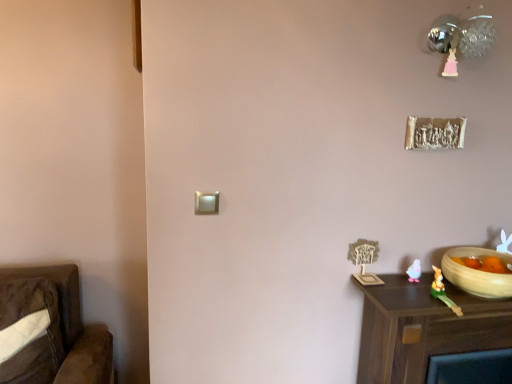
Question: Can you confirm if brown wood nightstand at lower right is positioned to the left of green rubber rabbit at lower right, arranged as the 1th toy when viewed from the front?

Choices:
 (A) yes
 (B) no

Answer: (B)

Question: Is there a large distance between brown wood nightstand at lower right and green rubber rabbit at lower right, which appears as the 2th toy when viewed from the back?

Choices:
 (A) yes
 (B) no

Answer: (B)

Question: From a real-world perspective, does brown wood nightstand at lower right sit lower than green rubber rabbit at lower right, which appears as the 2th toy when viewed from the back?

Choices:
 (A) yes
 (B) no

Answer: (A)

Question: Does brown wood nightstand at lower right come in front of green rubber rabbit at lower right, which appears as the 2th toy when viewed from the back?

Choices:
 (A) yes
 (B) no

Answer: (B)

Question: Is brown wood nightstand at lower right turned away from green rubber rabbit at lower right, arranged as the 1th toy when viewed from the front?

Choices:
 (A) no
 (B) yes

Answer: (A)

Question: Choose the correct answer: Is green rubber rabbit at lower right, arranged as the 1th toy when viewed from the front, inside metallic sphere at upper right or outside it?

Choices:
 (A) outside
 (B) inside

Answer: (A)

Question: Would you say green rubber rabbit at lower right, arranged as the 1th toy when viewed from the front, is to the left or to the right of metallic sphere at upper right in the picture?

Choices:
 (A) right
 (B) left

Answer: (B)

Question: Looking at their shapes, would you say green rubber rabbit at lower right, which appears as the 2th toy when viewed from the back, is wider or thinner than metallic sphere at upper right?

Choices:
 (A) wide
 (B) thin

Answer: (B)

Question: From their relative heights in the image, would you say green rubber rabbit at lower right, arranged as the 1th toy when viewed from the front, is taller or shorter than metallic sphere at upper right?

Choices:
 (A) short
 (B) tall

Answer: (A)

Question: From the image's perspective, is beige ceramic bowl at lower right above or below brown wood nightstand at lower right?

Choices:
 (A) below
 (B) above

Answer: (B)

Question: Would you say beige ceramic bowl at lower right is to the left or to the right of brown wood nightstand at lower right in the picture?

Choices:
 (A) left
 (B) right

Answer: (B)

Question: Looking at the image, does beige ceramic bowl at lower right seem bigger or smaller compared to brown wood nightstand at lower right?

Choices:
 (A) big
 (B) small

Answer: (B)

Question: Considering the positions of beige ceramic bowl at lower right and brown wood nightstand at lower right in the image, is beige ceramic bowl at lower right taller or shorter than brown wood nightstand at lower right?

Choices:
 (A) tall
 (B) short

Answer: (B)

Question: Is metallic sphere at upper right in front of or behind green rubber rabbit at lower right, arranged as the 1th toy when viewed from the front, in the image?

Choices:
 (A) front
 (B) behind

Answer: (A)

Question: Do you think metallic sphere at upper right is within green rubber rabbit at lower right, arranged as the 1th toy when viewed from the front, or outside of it?

Choices:
 (A) outside
 (B) inside

Answer: (A)